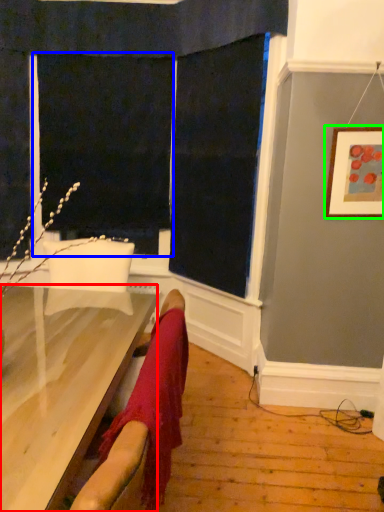
Question: Which object is positioned closest to furniture (highlighted by a red box)? Select from screen door (highlighted by a blue box) and picture frame (highlighted by a green box).

Choices:
 (A) screen door
 (B) picture frame

Answer: (B)